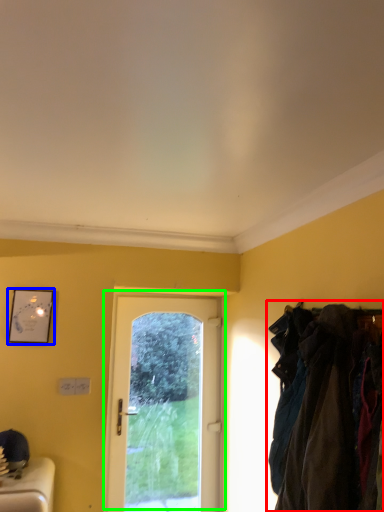
Question: Which object is positioned farthest from laundry (highlighted by a red box)? Select from picture frame (highlighted by a blue box) and door (highlighted by a green box).

Choices:
 (A) picture frame
 (B) door

Answer: (A)